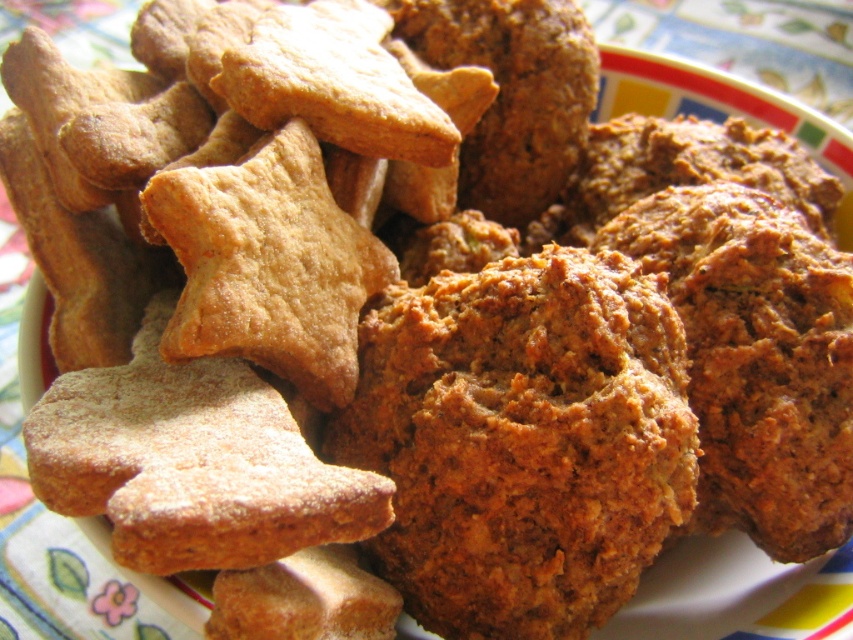
You are a baker checking the oven and see the brown crumbly muffin at center and the slightly browned dough at center on the plate. Which item is closer to you?

The brown crumbly muffin at center is closer to you than the slightly browned dough at center.

You are a baker checking the oven. You see a brown crumbly muffin at center and a slightly browned dough at center. Which one has a greater width?

The brown crumbly muffin at center might be wider than slightly browned dough at center, so the brown crumbly muffin at center likely has a greater width.

You are a baker who wants to place a new cookie on the plate. The plate has a coordinate system where the bottom left corner is the origin. The star cookies are placed at coordinates between 0.5 and 0.7 on the x and y axes. Is there enough space to place a new cookie at point (521,440) without overlapping?

The point (521,440) corresponds to the brown crumbly muffin at center, so placing a cookie there would overlap with the existing muffin. Choose another spot.